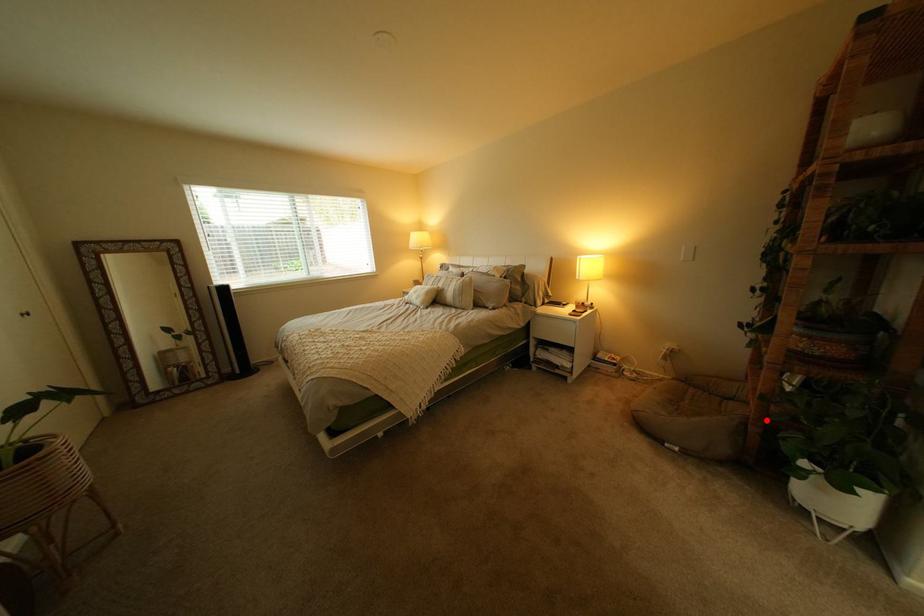
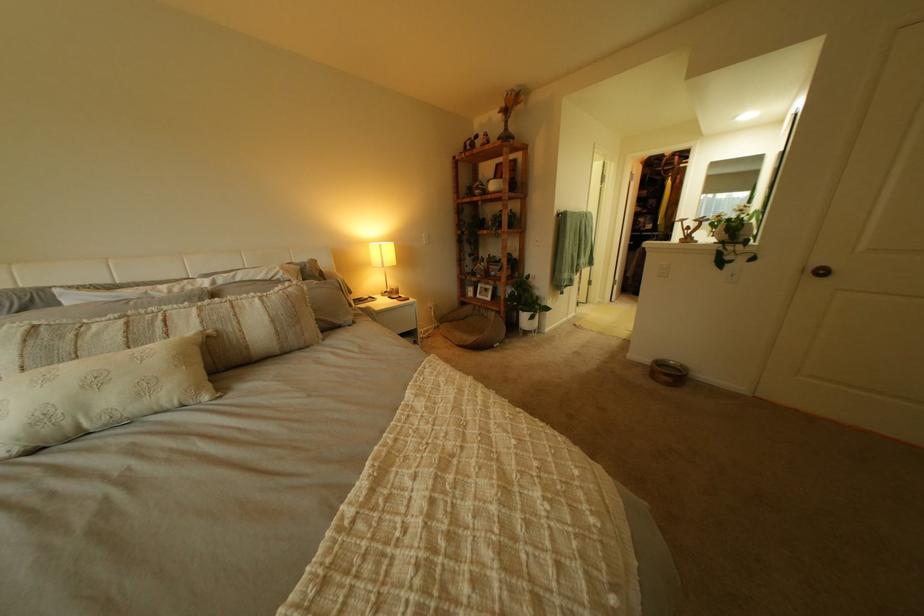
Find the pixel in the second image that matches the highlighted location in the first image.

(517, 314)